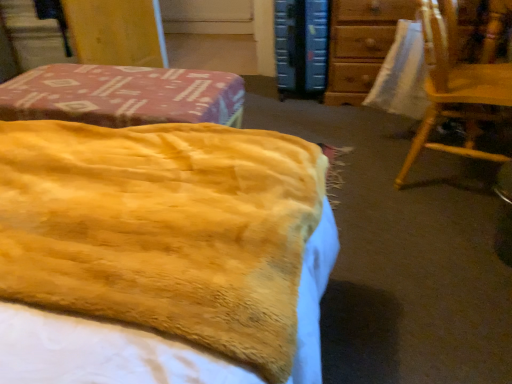
The height and width of the screenshot is (384, 512). I want to click on free space in front of wooden chair at right, so click(x=431, y=236).